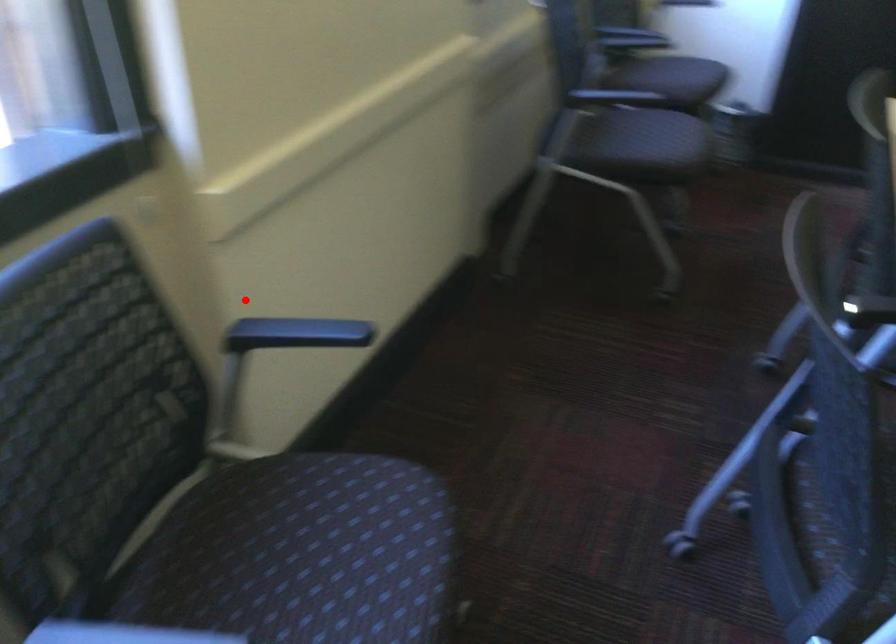
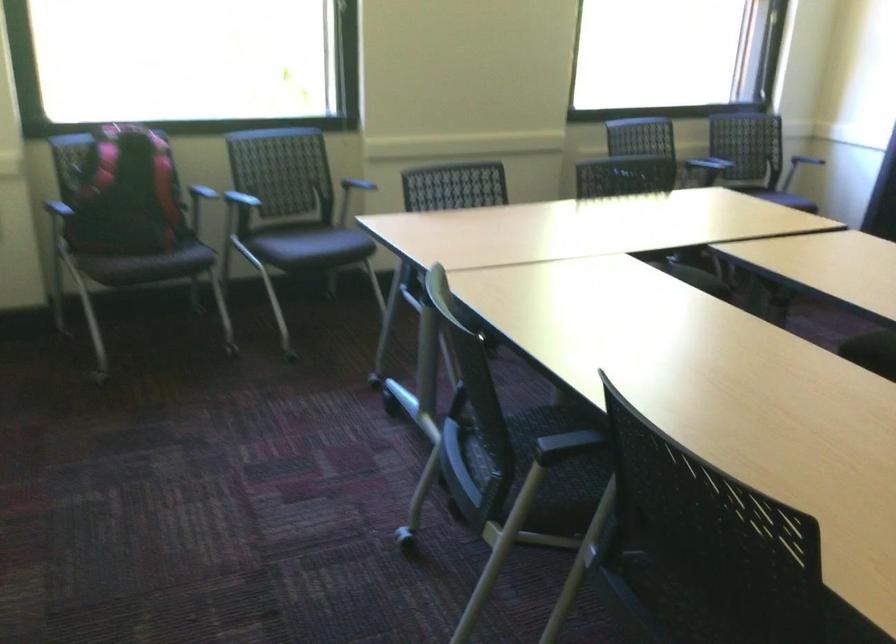
Where in the second image is the point corresponding to the highlighted location from the first image?

(362, 176)